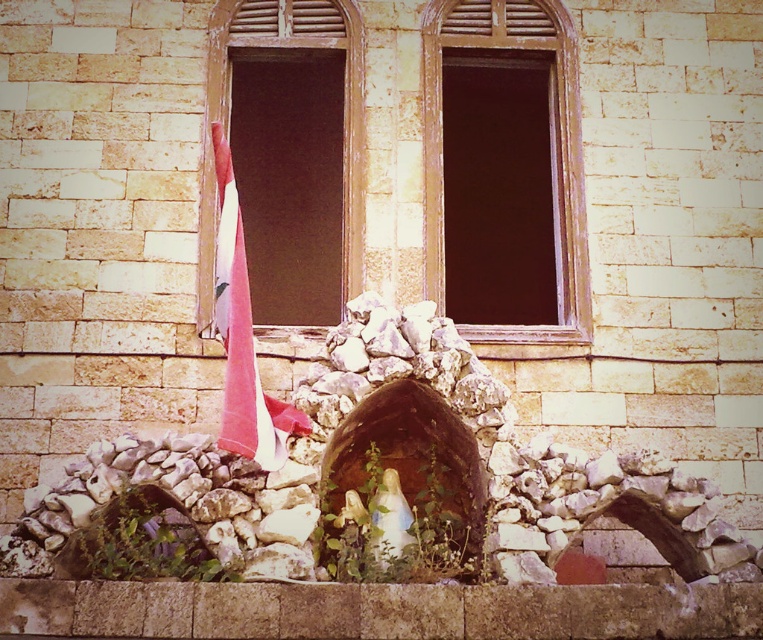
Question: Which point appears farthest from the camera in this image?

Choices:
 (A) (728, 624)
 (B) (233, 321)

Answer: (B)

Question: Which is nearer to the pink fabric umbrella at left?

Choices:
 (A) brown stone ledge at lower center
 (B) wooden frame at center

Answer: (A)

Question: Is brown stone ledge at lower center positioned before pink fabric umbrella at left?

Choices:
 (A) no
 (B) yes

Answer: (B)

Question: Is wooden window at center smaller than pink fabric umbrella at left?

Choices:
 (A) yes
 (B) no

Answer: (B)

Question: Does wooden frame at center appear on the left side of pink fabric umbrella at left?

Choices:
 (A) no
 (B) yes

Answer: (A)

Question: Based on their relative distances, which object is nearer to the wooden frame at center?

Choices:
 (A) wooden window at center
 (B) pink fabric umbrella at left

Answer: (A)